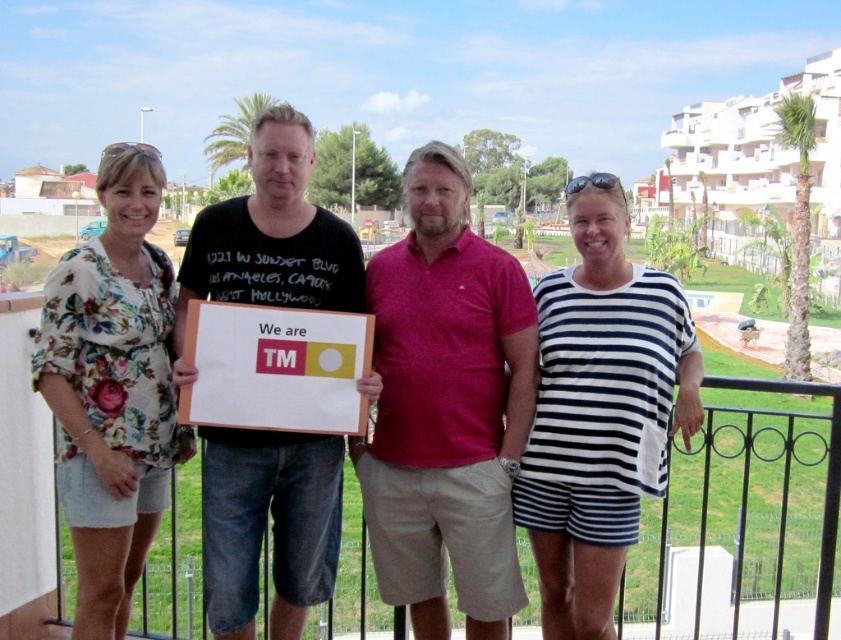
Which is more to the left, red cotton polo shirt at center or floral fabric dress at left?

floral fabric dress at left is more to the left.

Which is behind, point (442, 381) or point (107, 509)?

The point (442, 381) is behind.

Who is more distant from viewer, (495,364) or (135,298)?

The point (495,364) is behind.

This screenshot has width=841, height=640. In order to click on red cotton polo shirt at center in this screenshot , I will do `click(447, 406)`.

Can you confirm if black cotton t-shirt at center is bigger than matte black t-shirt at center?

Actually, black cotton t-shirt at center might be smaller than matte black t-shirt at center.

At what (x,y) coordinates should I click in order to perform the action: click on black cotton t-shirt at center. Please return your answer as a coordinate pair (x, y). This screenshot has width=841, height=640. Looking at the image, I should click on (265, 522).

The image size is (841, 640). Find the location of `black cotton t-shirt at center`. black cotton t-shirt at center is located at coordinates (265, 522).

Who is higher up, white striped dress at center or matte black t-shirt at center?

matte black t-shirt at center

The image size is (841, 640). In order to click on white striped dress at center in this screenshot , I will do `click(600, 412)`.

Locate an element on the screen. This screenshot has width=841, height=640. white striped dress at center is located at coordinates (600, 412).